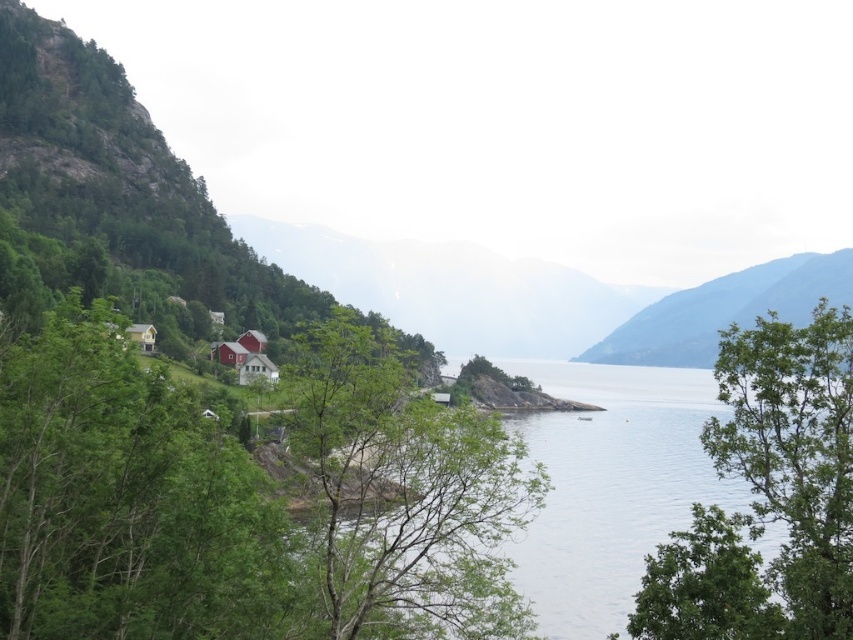
You are a hiker who wants to take a photo of the gray rocky mountain at upper center from the green leafy tree at right. Considering the distance between them, do you think you can clearly capture the mountain in your photo without any obstructions?

The green leafy tree at right and gray rocky mountain at upper center are 1753.79 feet apart. Since the distance is quite large, the mountain may appear small in the photo, but there should be no obstructions as the mountain is in the background and the tree is in the foreground. However, clarity might depend on the camera lens quality.

Looking at this image, you are a hiker planning to take a photo of the gray rocky mountain at upper center. You notice the green leafy tree at right might block your view. Based on the scene description, will the tree obscure the mountain in your photo?

The green leafy tree at right has a lesser height compared to gray rocky mountain at upper center, so the tree will not obscure the mountain in your photo since the mountain is taller.